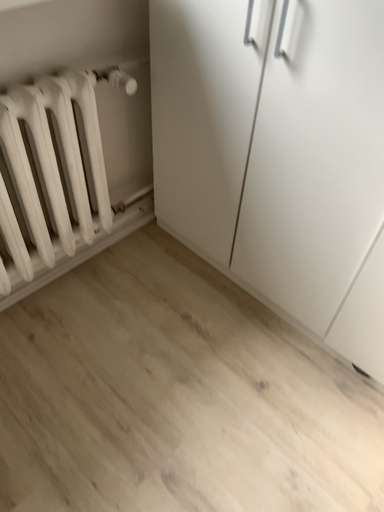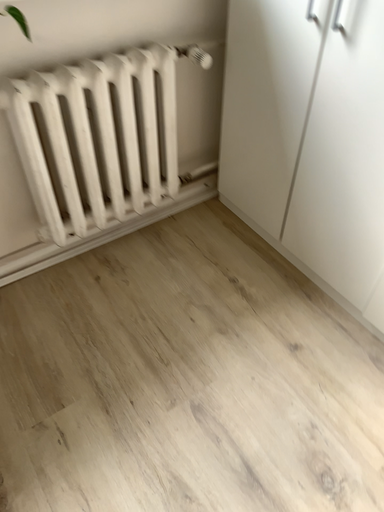
Question: How did the camera likely rotate when shooting the video?

Choices:
 (A) rotated left
 (B) rotated right

Answer: (A)